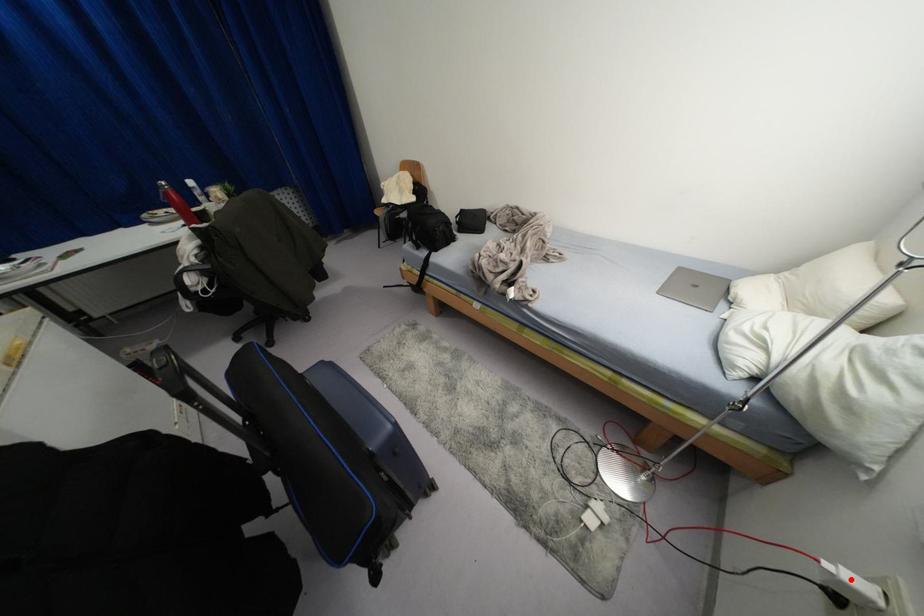
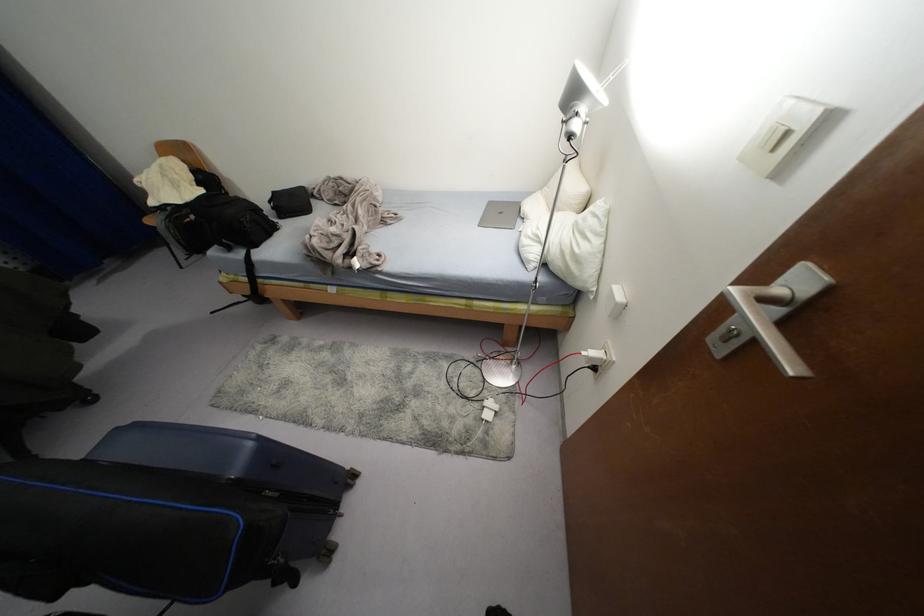
Question: I am providing you with two images of the same scene from different viewpoints. In image1, a red point is highlighted. Considering the same 3D point in image2, which of the following is correct?

Choices:
 (A) It is closer
 (B) It is farther

Answer: (A)